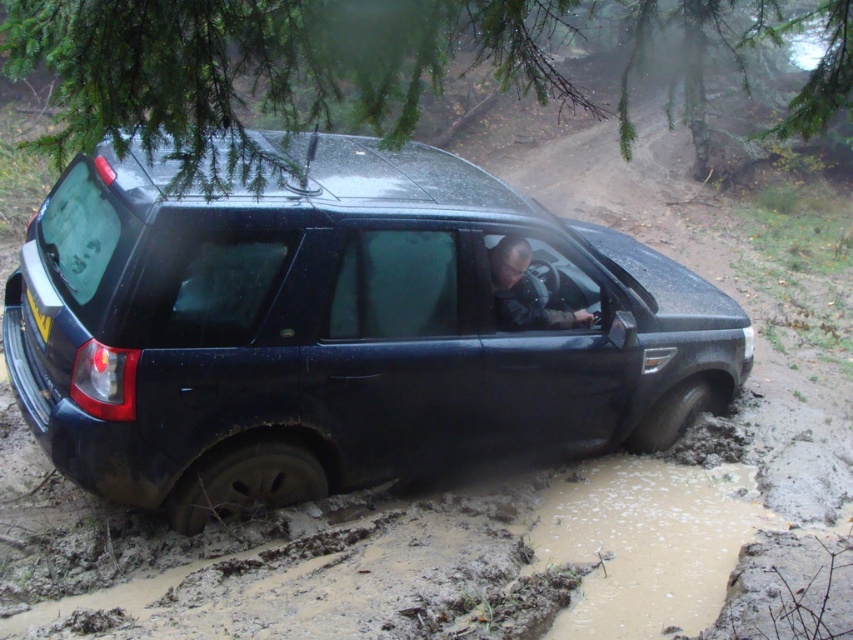
Question: Which point is farther to the camera?

Choices:
 (A) (532, 536)
 (B) (12, 280)

Answer: (B)

Question: Does brown muddy puddle at lower center have a smaller size compared to yellow matte license plate at rear?

Choices:
 (A) yes
 (B) no

Answer: (B)

Question: Which point is farther to the camera?

Choices:
 (A) (54, 307)
 (B) (64, 280)
 (C) (524, 253)

Answer: (C)

Question: Which object is closer to the camera taking this photo?

Choices:
 (A) glossy black suv at center
 (B) brown muddy puddle at lower center
 (C) yellow matte license plate at rear

Answer: (B)

Question: Can you confirm if dark gray fabric jacket at center is wider than yellow matte license plate at rear?

Choices:
 (A) yes
 (B) no

Answer: (A)

Question: Is glossy black suv at center thinner than brown muddy puddle at lower center?

Choices:
 (A) yes
 (B) no

Answer: (B)